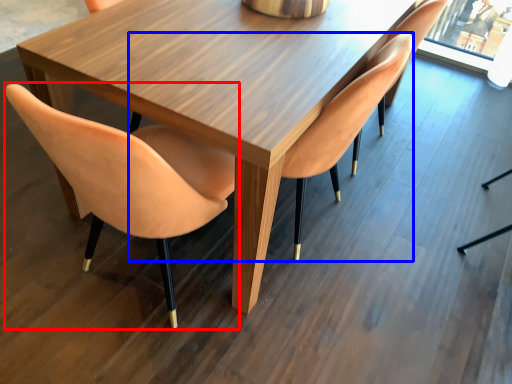
Question: Which object appears farthest to the camera in this image, chair (highlighted by a red box) or chair (highlighted by a blue box)?

Choices:
 (A) chair
 (B) chair

Answer: (B)